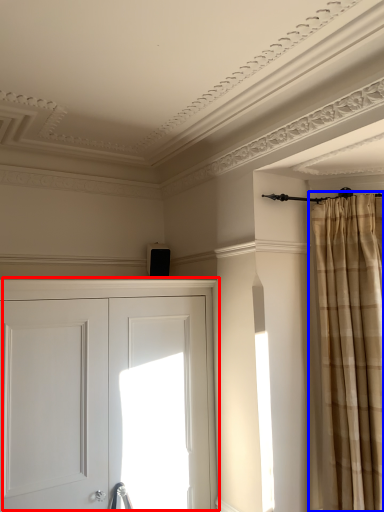
Question: Which object appears farthest to the camera in this image, door (highlighted by a red box) or curtain (highlighted by a blue box)?

Choices:
 (A) door
 (B) curtain

Answer: (B)